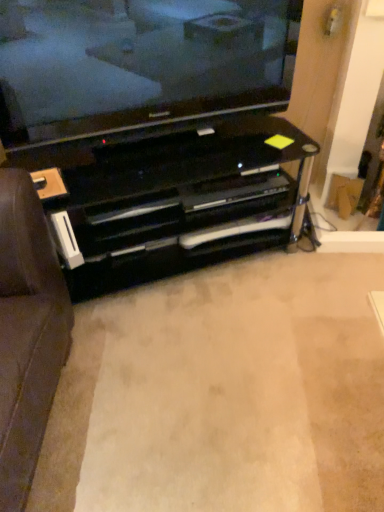
Question: Can you confirm if black glossy tv stand at center is shorter than black glass television at upper center?

Choices:
 (A) yes
 (B) no

Answer: (A)

Question: Is black glossy tv stand at center outside black glass television at upper center?

Choices:
 (A) yes
 (B) no

Answer: (A)

Question: Does black glossy tv stand at center appear on the left side of black glass television at upper center?

Choices:
 (A) no
 (B) yes

Answer: (A)

Question: Is black glass television at upper center inside black glossy tv stand at center?

Choices:
 (A) no
 (B) yes

Answer: (A)

Question: From the image's perspective, is black glossy tv stand at center above black glass television at upper center?

Choices:
 (A) yes
 (B) no

Answer: (B)

Question: Can you confirm if black glossy tv stand at center is positioned to the right of black glass television at upper center?

Choices:
 (A) no
 (B) yes

Answer: (B)

Question: Are black glossy entertainment center at center and black glass television at upper center far apart?

Choices:
 (A) yes
 (B) no

Answer: (B)

Question: Can you confirm if black glossy entertainment center at center is bigger than black glass television at upper center?

Choices:
 (A) no
 (B) yes

Answer: (B)

Question: Is black glossy entertainment center at center further to the viewer compared to black glass television at upper center?

Choices:
 (A) yes
 (B) no

Answer: (A)

Question: Does black glossy entertainment center at center have a lesser height compared to black glass television at upper center?

Choices:
 (A) yes
 (B) no

Answer: (A)

Question: From the image's perspective, is black glossy entertainment center at center beneath black glass television at upper center?

Choices:
 (A) yes
 (B) no

Answer: (A)

Question: Does black glossy entertainment center at center appear on the left side of black glass television at upper center?

Choices:
 (A) no
 (B) yes

Answer: (B)

Question: Can you confirm if black glossy entertainment center at center is wider than black glossy tv stand at center?

Choices:
 (A) no
 (B) yes

Answer: (A)